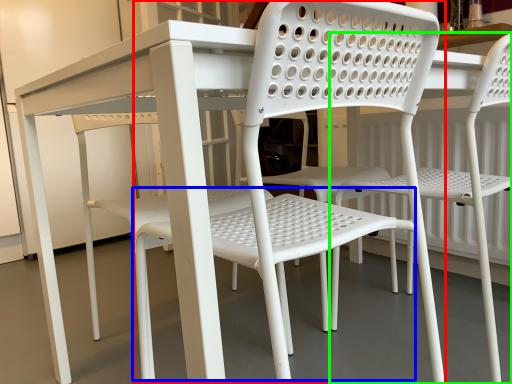
Question: Estimate the real-world distances between objects in this image. Which object is closer to chair (highlighted by a red box), bar stool (highlighted by a blue box) or chair (highlighted by a green box)?

Choices:
 (A) bar stool
 (B) chair

Answer: (A)